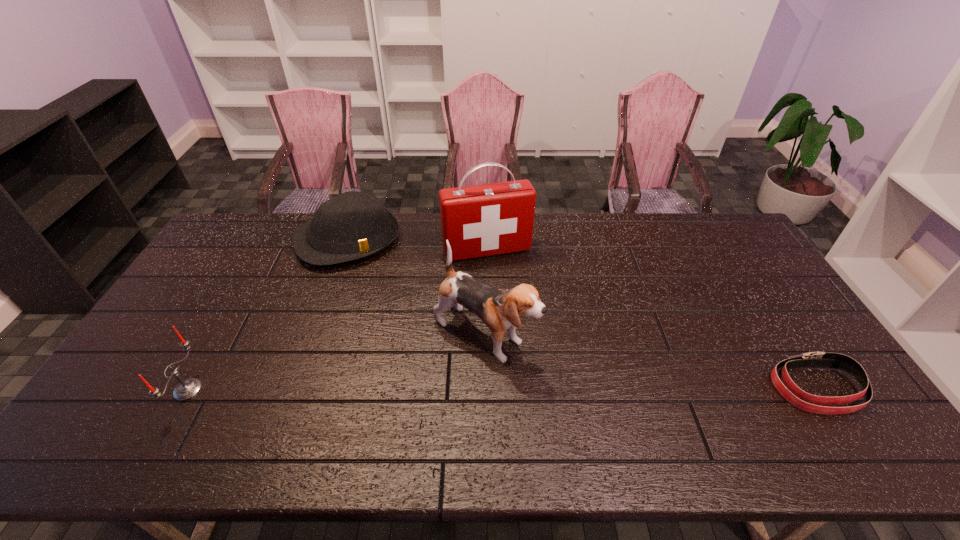
You are a GUI agent. You are given a task and a screenshot of the screen. Output one action in this format:
    pyautogui.click(x=<x>, y=<y>)
    Task: Click on the vacant point located between the dog collar and the first-aid kit
    
    Given the screenshot: What is the action you would take?
    pyautogui.click(x=652, y=319)

The image size is (960, 540). Find the location of `object identified as the third closest to the fourth object from right to left`. object identified as the third closest to the fourth object from right to left is located at coordinates (187, 389).

The image size is (960, 540). In order to click on object that is the fourth nearest to the leftmost object in this screenshot , I will do `click(800, 399)`.

What are the coordinates of `blank area in the image that satisfies the following two spatial constraints: 1. on the front side of the second object from left to right; 2. on the right side of the shortest object` in the screenshot? It's located at pos(296,388).

Identify the location of free region that satisfies the following two spatial constraints: 1. on the front side of the first-aid kit; 2. on the right side of the rightmost object. pyautogui.click(x=490, y=388).

Locate an element on the screen. The height and width of the screenshot is (540, 960). free space that satisfies the following two spatial constraints: 1. on the front side of the dog collar; 2. on the left side of the fedora is located at coordinates (296, 388).